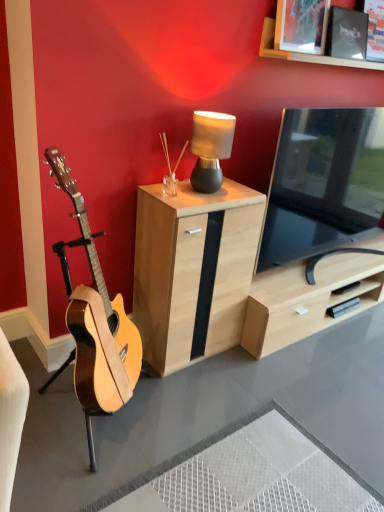
Where is `free space to the right of natural wood guitar at left`? free space to the right of natural wood guitar at left is located at coordinates (204, 420).